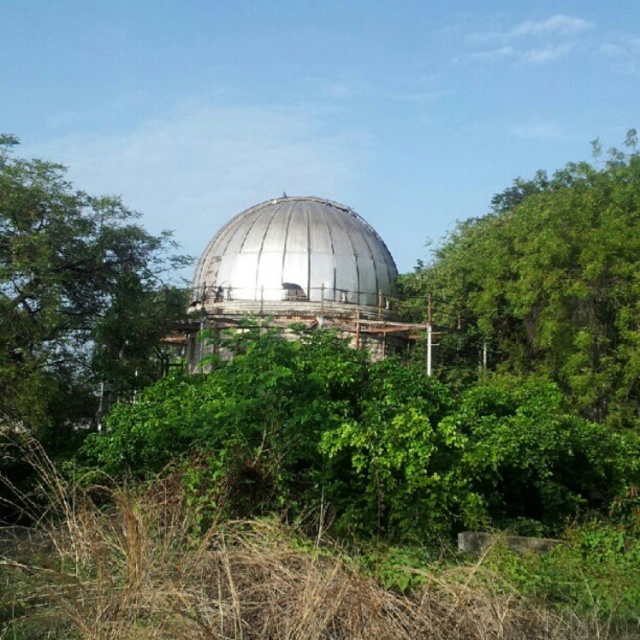
Based on the photo, you are standing at the base of the dome structure and want to reach the green leafy tree at upper right. The path is clear, but you have a 35 meter rope to secure your equipment. Is the rope sufficient to reach the tree from your current position?

The green leafy tree at upper right is 37.86 meters away from viewer. Since the rope is only 35 meters long, it is not sufficient to reach the tree from your current position.